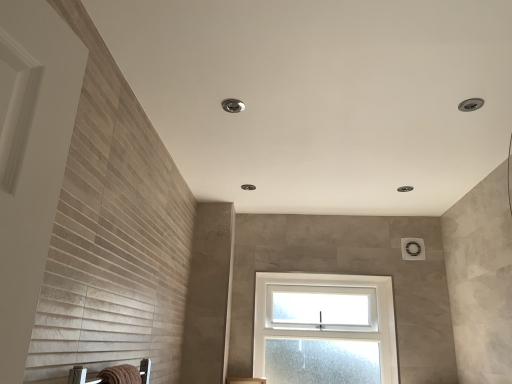
Question: Could clear glass window at center be considered to be inside brown textured towel at lower left?

Choices:
 (A) no
 (B) yes

Answer: (A)

Question: Can you confirm if brown textured towel at lower left is positioned to the left of clear glass window at center?

Choices:
 (A) yes
 (B) no

Answer: (A)

Question: Is brown textured towel at lower left positioned before clear glass window at center?

Choices:
 (A) yes
 (B) no

Answer: (A)

Question: Can you confirm if brown textured towel at lower left is shorter than clear glass window at center?

Choices:
 (A) yes
 (B) no

Answer: (A)

Question: From a real-world perspective, does brown textured towel at lower left stand above clear glass window at center?

Choices:
 (A) yes
 (B) no

Answer: (B)

Question: Is brown textured towel at lower left positioned far away from clear glass window at center?

Choices:
 (A) yes
 (B) no

Answer: (A)

Question: Is the position of clear glass window at center less distant than that of brown textured towel at lower left?

Choices:
 (A) no
 (B) yes

Answer: (A)

Question: Is clear glass window at center thinner than brown textured towel at lower left?

Choices:
 (A) no
 (B) yes

Answer: (A)

Question: Considering the relative sizes of clear glass window at center and brown textured towel at lower left in the image provided, is clear glass window at center wider than brown textured towel at lower left?

Choices:
 (A) no
 (B) yes

Answer: (B)

Question: From a real-world perspective, is clear glass window at center beneath brown textured towel at lower left?

Choices:
 (A) no
 (B) yes

Answer: (A)

Question: From the image's perspective, does clear glass window at center appear lower than brown textured towel at lower left?

Choices:
 (A) yes
 (B) no

Answer: (A)

Question: Is clear glass window at center bigger than brown textured towel at lower left?

Choices:
 (A) no
 (B) yes

Answer: (B)

Question: From the image's perspective, is brown textured towel at lower left positioned above or below clear glass window at center?

Choices:
 (A) below
 (B) above

Answer: (B)